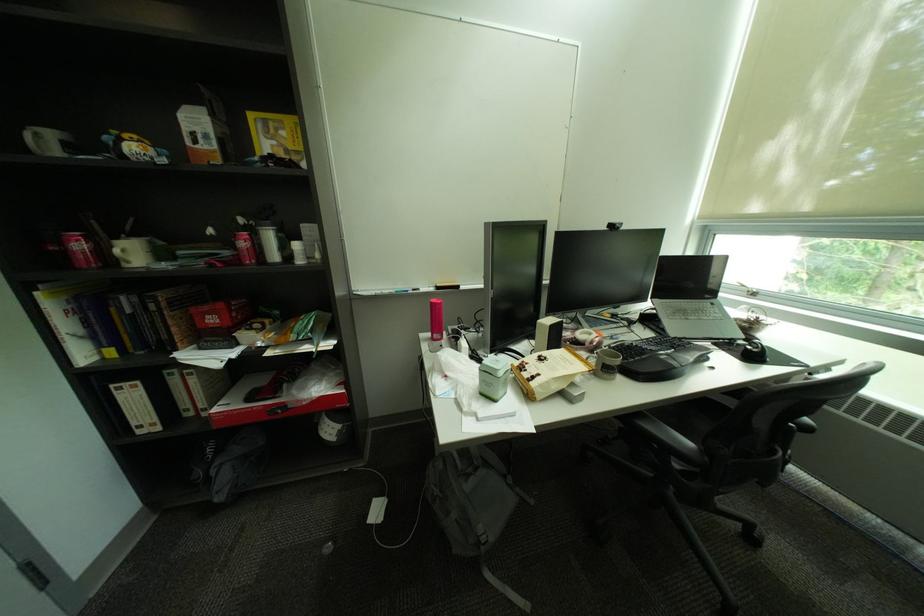
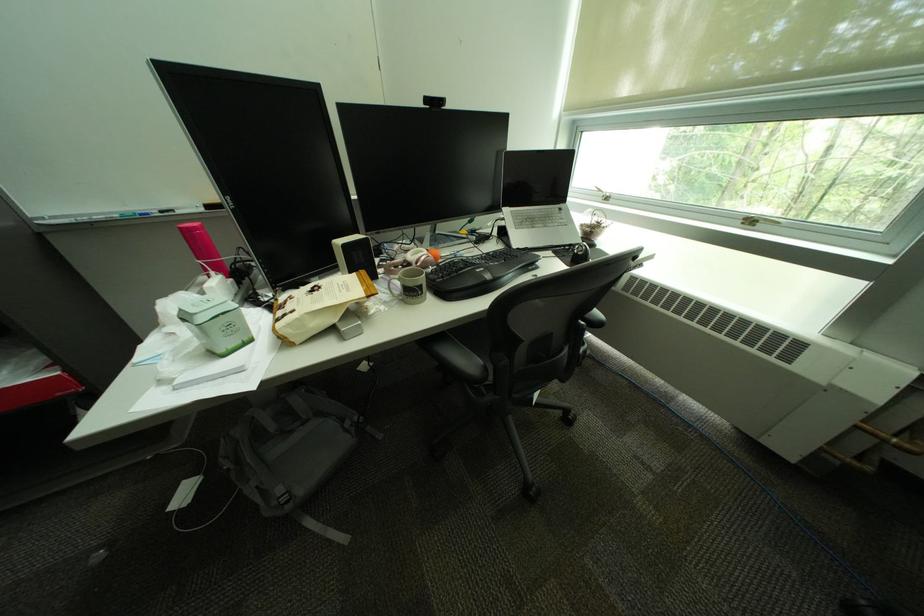
Find the pixel in the second image that matches (631,344) in the first image.

(463, 261)